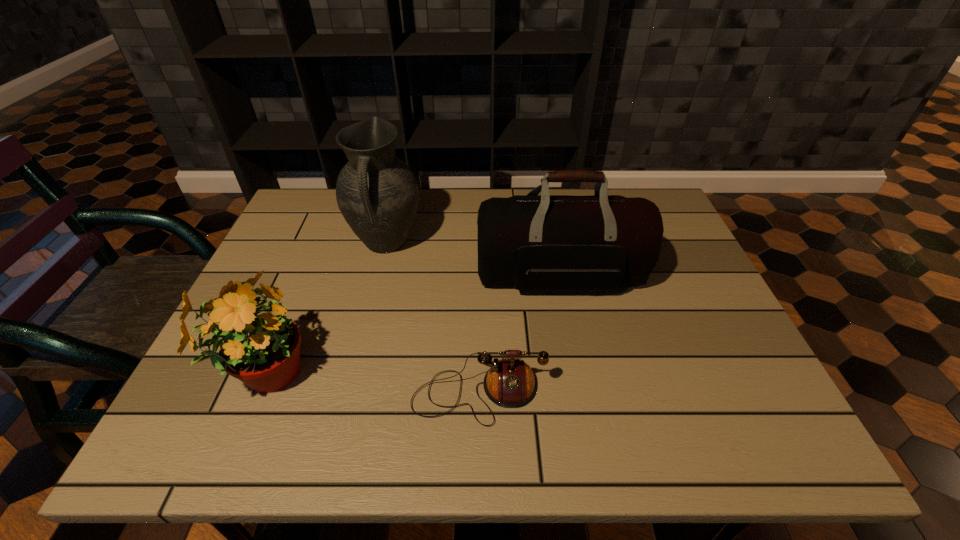
Locate an element on the screen. This screenshot has width=960, height=540. pitcher is located at coordinates [x=377, y=193].

At what (x,y) coordinates should I click in order to perform the action: click on duffel bag. Please return your answer as a coordinate pair (x, y). Looking at the image, I should click on (545, 242).

Find the location of `flowerpot`. flowerpot is located at coordinates (261, 348).

You are a GUI agent. You are given a task and a screenshot of the screen. Output one action in this format:
    pyautogui.click(x=<x>, y=<y>)
    Task: Click on the telephone
    Image resolution: width=960 pixels, height=540 pixels.
    Given the screenshot: What is the action you would take?
    pyautogui.click(x=510, y=383)

Identify the location of vacant space situated 0.360m on the side of the pitcher with the handle. This screenshot has width=960, height=540. (349, 389).

Find the location of `vacant area located 0.200m on the front pocket of the duffel bag`. vacant area located 0.200m on the front pocket of the duffel bag is located at coordinates (580, 374).

At what (x,y) coordinates should I click in order to perform the action: click on free region located on the right of the flowerpot. Please return your answer as a coordinate pair (x, y). This screenshot has height=540, width=960. Looking at the image, I should click on (446, 375).

Identify the location of object at the far edge. Image resolution: width=960 pixels, height=540 pixels. (377, 193).

The height and width of the screenshot is (540, 960). Identify the location of flowerpot located at the near edge. (261, 348).

Identify the location of telephone that is at the near edge. The height and width of the screenshot is (540, 960). (510, 383).